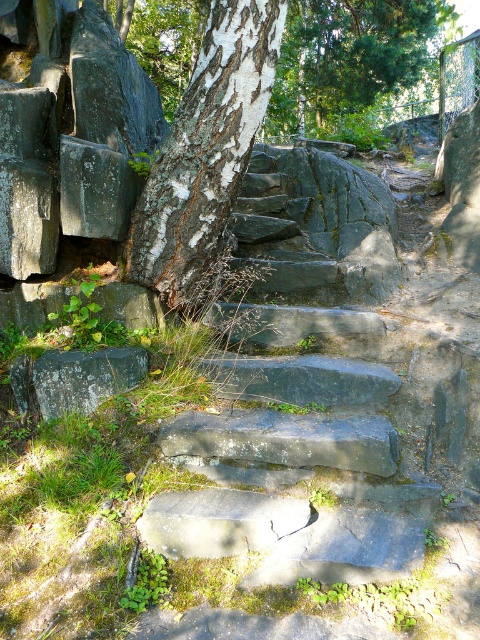
Is smooth stone stairs at center positioned behind white bark tree at center?

No, smooth stone stairs at center is closer to the viewer.

Between smooth stone stairs at center and white bark tree at center, which one has more height?

smooth stone stairs at center

Who is more distant from viewer, [278,484] or [200,104]?

Positioned behind is point [200,104].

Image resolution: width=480 pixels, height=640 pixels. Identify the location of smooth stone stairs at center. (299, 394).

Who is positioned more to the left, white bark tree at center or green textured tree at upper center?

From the viewer's perspective, white bark tree at center appears more on the left side.

Is white bark tree at center further to the viewer compared to green textured tree at upper center?

No.

Find the location of a particular element. white bark tree at center is located at coordinates (205, 147).

Is point (360, 228) farther from camera compared to point (388, 42)?

No, it is in front of (388, 42).

From the picture: Is smooth stone stairs at center above green textured tree at upper center?

No, smooth stone stairs at center is not above green textured tree at upper center.

Which is in front, point (239, 262) or point (397, 65)?

Point (239, 262) is more forward.

This screenshot has height=640, width=480. What are the coordinates of `smooth stone stairs at center` in the screenshot? It's located at (299, 394).